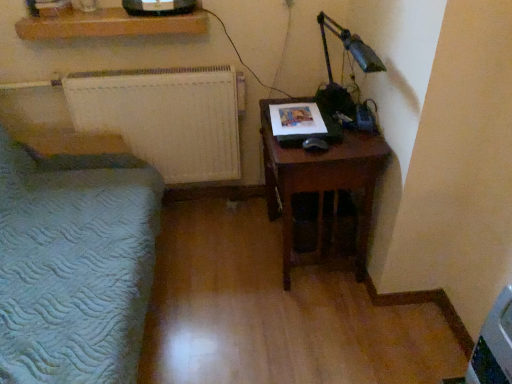
What is the approximate width of white textured radiator at left?

white textured radiator at left is 89.97 centimeters wide.

What do you see at coordinates (108, 25) in the screenshot?
I see `wooden shelf at upper center` at bounding box center [108, 25].

Measure the distance between point (52, 29) and camera.

The distance of point (52, 29) from camera is 1.90 meters.

Image resolution: width=512 pixels, height=384 pixels. What do you see at coordinates (320, 182) in the screenshot?
I see `brown wooden nightstand at right` at bounding box center [320, 182].

Measure the distance between white textured radiator at left and camera.

A distance of 1.98 meters exists between white textured radiator at left and camera.

Locate an element on the screen. The width and height of the screenshot is (512, 384). metallic green desk lamp at upper right is located at coordinates (353, 58).

Is brown wooden nightstand at right facing towards metallic green desk lamp at upper right?

No, brown wooden nightstand at right is not facing towards metallic green desk lamp at upper right.

Which of these two, brown wooden nightstand at right or metallic green desk lamp at upper right, stands taller?

Standing taller between the two is brown wooden nightstand at right.

From the image's perspective, which object appears higher, brown wooden nightstand at right or metallic green desk lamp at upper right?

metallic green desk lamp at upper right appears higher in the image.

How different are the orientations of brown wooden nightstand at right and metallic green desk lamp at upper right in degrees?

brown wooden nightstand at right and metallic green desk lamp at upper right are facing 0.294 degrees away from each other.

Can you confirm if white textured radiator at left is shorter than brown wooden nightstand at right?

Correct, white textured radiator at left is not as tall as brown wooden nightstand at right.

From the image's perspective, is white textured radiator at left under brown wooden nightstand at right?

No.

Which object is wider, white textured radiator at left or brown wooden nightstand at right?

With larger width is brown wooden nightstand at right.

Which object is more forward, white textured radiator at left or brown wooden nightstand at right?

Positioned in front is brown wooden nightstand at right.

Is wooden shelf at upper center located within brown wooden nightstand at right?

No, wooden shelf at upper center is not inside brown wooden nightstand at right.

Considering the positions of point (283, 228) and point (124, 19), is point (283, 228) closer or farther from the camera than point (124, 19)?

Point (283, 228) is farther from the camera than point (124, 19).

At what (x,y) coordinates should I click in order to perform the action: click on nightstand below the wooden shelf at upper center (from the image's perspective). Please return your answer as a coordinate pair (x, y). Looking at the image, I should click on [x=320, y=182].

Considering the relative sizes of brown wooden nightstand at right and wooden shelf at upper center in the image provided, is brown wooden nightstand at right thinner than wooden shelf at upper center?

No, brown wooden nightstand at right is not thinner than wooden shelf at upper center.

Is white textured radiator at left shorter than metallic green desk lamp at upper right?

No, white textured radiator at left is not shorter than metallic green desk lamp at upper right.

Find the location of a particular element. furniture below the metallic green desk lamp at upper right (from a real-world perspective) is located at coordinates (74, 264).

Measure the distance from white textured radiator at left to metallic green desk lamp at upper right.

The distance of white textured radiator at left from metallic green desk lamp at upper right is 3.63 feet.

Is white textured radiator at left looking in the opposite direction of metallic green desk lamp at upper right?

No, white textured radiator at left's orientation is not away from metallic green desk lamp at upper right.

Considering the positions of point (185, 15) and point (90, 284), is point (185, 15) closer or farther from the camera than point (90, 284)?

Point (185, 15).

Is wooden shelf at upper center next to white textured radiator at left and touching it?

There is a gap between wooden shelf at upper center and white textured radiator at left.

What's the angular difference between wooden shelf at upper center and white textured radiator at left's facing directions?

88.8 degrees separate the facing orientations of wooden shelf at upper center and white textured radiator at left.

Considering the sizes of objects wooden shelf at upper center and white textured radiator at left in the image provided, who is taller, wooden shelf at upper center or white textured radiator at left?

With more height is white textured radiator at left.

Looking at this image, between white textured radiator at left and white textured radiator at left, which one has less height?

With less height is white textured radiator at left.

In the image, is white textured radiator at left on the left side or the right side of white textured radiator at left?

Clearly, white textured radiator at left is on the left of white textured radiator at left in the image.

Is point (29, 368) positioned behind point (210, 124)?

No, it is not.

Is white textured radiator at left not within white textured radiator at left?

white textured radiator at left is positioned outside white textured radiator at left.

Is metallic green desk lamp at upper right touching white textured radiator at left?

metallic green desk lamp at upper right and white textured radiator at left are clearly separated.

From the image's perspective, is metallic green desk lamp at upper right located beneath white textured radiator at left?

No, from the image's perspective, metallic green desk lamp at upper right is not below white textured radiator at left.

Consider the image. Can you confirm if metallic green desk lamp at upper right is thinner than white textured radiator at left?

Correct, the width of metallic green desk lamp at upper right is less than that of white textured radiator at left.

I want to click on nightstand located on the left of metallic green desk lamp at upper right, so click(320, 182).

Locate an element on the screen. radiator that appears behind the brown wooden nightstand at right is located at coordinates (165, 117).

When comparing their distances from white textured radiator at left, does metallic green desk lamp at upper right or white textured radiator at left seem further?

Among the two, metallic green desk lamp at upper right is located further to white textured radiator at left.

From the picture: From the image, which object appears to be farther from wooden shelf at upper center, white textured radiator at left or brown wooden nightstand at right?

brown wooden nightstand at right.

Looking at the image, which one is located closer to white textured radiator at left, brown wooden nightstand at right or wooden shelf at upper center?

Among the two, wooden shelf at upper center is located nearer to white textured radiator at left.

Based on their spatial positions, is white textured radiator at left or white textured radiator at left closer to wooden shelf at upper center?

white textured radiator at left is closer to wooden shelf at upper center.

Which object lies nearer to the anchor point white textured radiator at left, brown wooden nightstand at right or metallic green desk lamp at upper right?

brown wooden nightstand at right is positioned closer to the anchor white textured radiator at left.

Based on their spatial positions, is white textured radiator at left or wooden shelf at upper center further from brown wooden nightstand at right?

The object further to brown wooden nightstand at right is wooden shelf at upper center.

Estimate the real-world distances between objects in this image. Which object is further from white textured radiator at left, wooden shelf at upper center or white textured radiator at left?

white textured radiator at left is positioned further to the anchor white textured radiator at left.

Looking at the image, which one is located closer to white textured radiator at left, brown wooden nightstand at right or metallic green desk lamp at upper right?

brown wooden nightstand at right is closer to white textured radiator at left.

Image resolution: width=512 pixels, height=384 pixels. What are the coordinates of `nightstand situated between wooden shelf at upper center and metallic green desk lamp at upper right from left to right` in the screenshot? It's located at (320, 182).

Locate an element on the screen. Image resolution: width=512 pixels, height=384 pixels. lamp between white textured radiator at left and white textured radiator at left along the z-axis is located at coordinates coord(353,58).

The height and width of the screenshot is (384, 512). I want to click on nightstand between white textured radiator at left and wooden shelf at upper center in the front-back direction, so click(320, 182).

Find the location of a particular element. lamp between white textured radiator at left and wooden shelf at upper center from front to back is located at coordinates (353, 58).